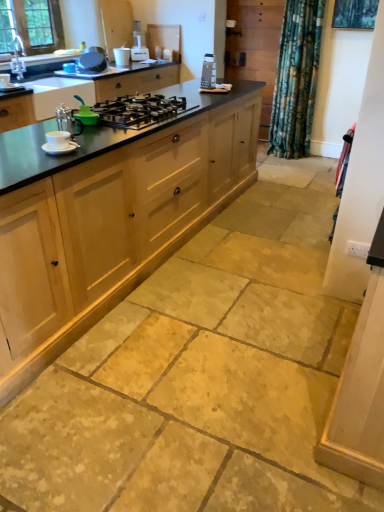
You are a GUI agent. You are given a task and a screenshot of the screen. Output one action in this format:
    pyautogui.click(x=<x>, y=<y>)
    Task: Click on the free area below metallic silver pot at upper center, which appears as the 3th appliance when ordered from the bottom (from a real-world perspective)
    
    Given the screenshot: What is the action you would take?
    pyautogui.click(x=118, y=66)